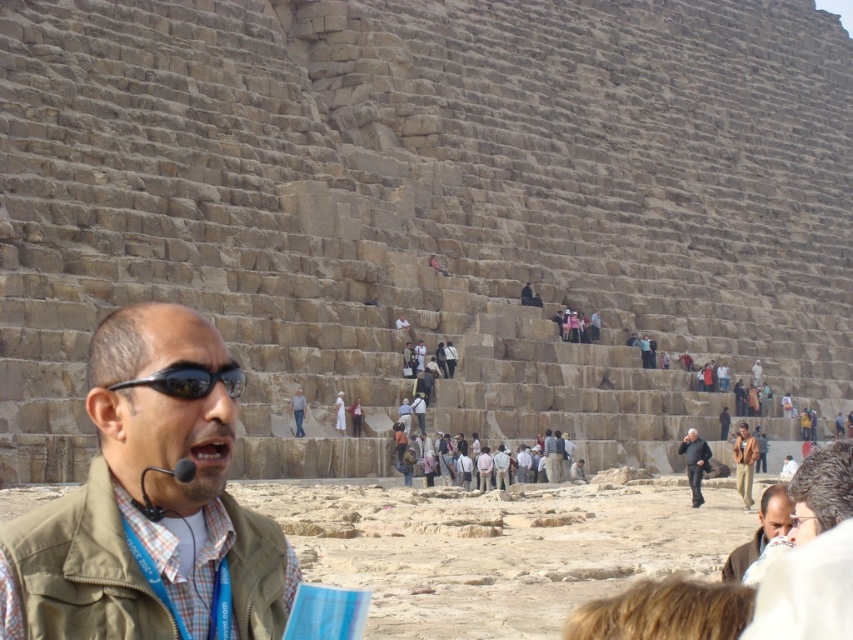
You are a tourist visiting the Great Pyramid of Giza and see a brown leather jacket at lower right and a dark brown leather jacket at center. Which jacket is positioned further to the east?

The brown leather jacket at lower right is to the right of the dark brown leather jacket at center, so the brown leather jacket at lower right is positioned further to the east.

You are a tourist standing in front of the Great Pyramid of Giza and notice a man in the foreground wearing two items. Which item, the black reflective sunglasses at center or the dark brown leather jacket at center, is shorter in height?

The black reflective sunglasses at center is not as tall as the dark brown leather jacket at center, so the sunglasses are shorter in height.

You are a photographer positioned at the base of the Great Pyramid of Giza. You want to take a photo that includes both the green fabric vest at center and the brown leather jacket at lower right. Which object should you focus on first to ensure both are in sharp focus?

The green fabric vest at center is closer to the viewer than the brown leather jacket at lower right. To ensure both are in sharp focus, you should focus on the green fabric vest at center first, as it is closer, and the brown leather jacket at lower right will fall within the depth of field if the focus is set properly.